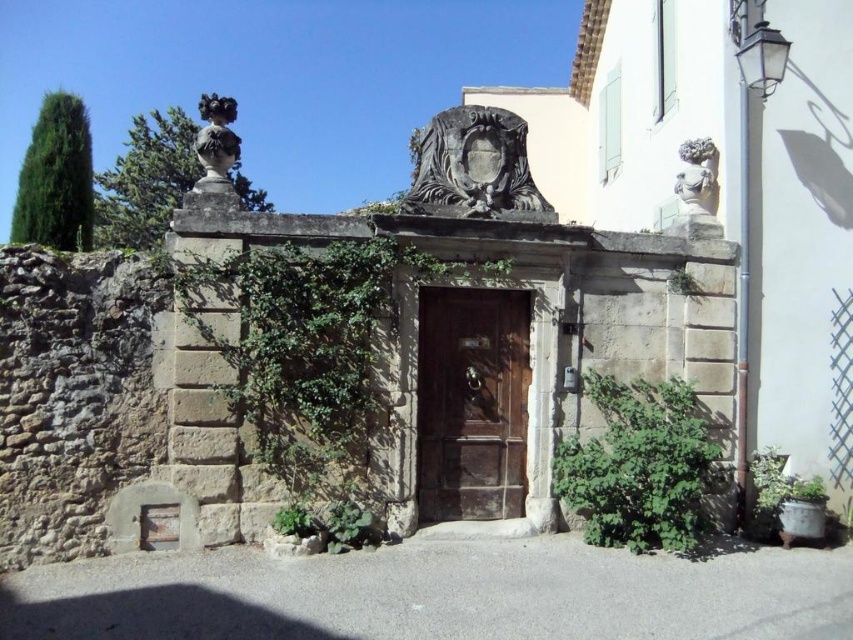
Question: Estimate the real-world distances between objects in this image. Which object is farther from the green leafy ivy at left?

Choices:
 (A) polished bronze bust at upper left
 (B) wooden door at center

Answer: (B)

Question: Which of the following is the closest to the observer?

Choices:
 (A) carved stone crest at upper center
 (B) wooden door at center

Answer: (A)

Question: Among these points, which one is nearest to the camera?

Choices:
 (A) (463, 484)
 (B) (694, 147)
 (C) (631, 490)
 (D) (473, 198)

Answer: (C)

Question: Does wooden door at center have a lesser width compared to carved stone crest at upper center?

Choices:
 (A) no
 (B) yes

Answer: (B)

Question: Does wooden door at center lie behind polished bronze bust at upper left?

Choices:
 (A) no
 (B) yes

Answer: (B)

Question: Is wooden door at center to the left of polished bronze bust at upper left from the viewer's perspective?

Choices:
 (A) yes
 (B) no

Answer: (B)